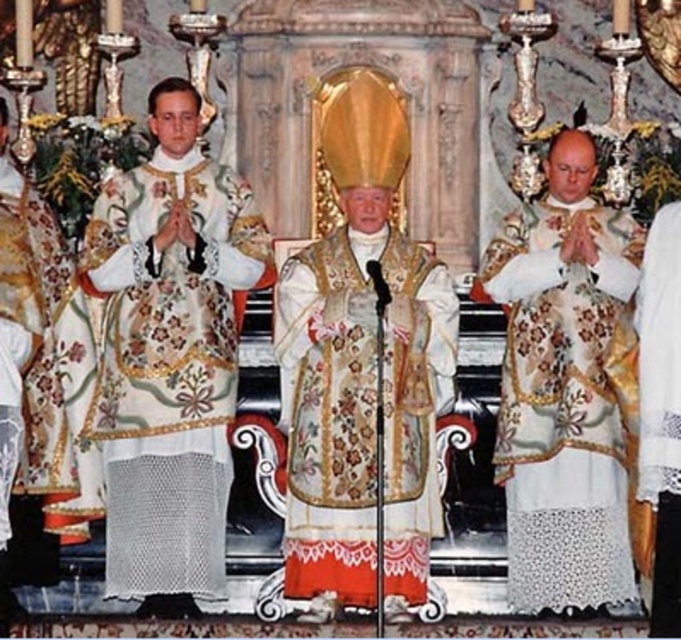
Question: Is embroidered silk vestment at center thinner than white lace robe at right?

Choices:
 (A) yes
 (B) no

Answer: (B)

Question: Which point appears closest to the camera in this image?

Choices:
 (A) (355, 536)
 (B) (3, 344)
 (C) (550, 221)

Answer: (B)

Question: Which point is farther to the camera?

Choices:
 (A) white embroidered robe at center
 (B) white lace robe at right
 (C) embroidered silk vestment at center

Answer: (A)

Question: Which point appears farthest from the camera in this image?

Choices:
 (A) (571, 209)
 (B) (646, 324)
 (C) (364, 582)
 (D) (202, 188)

Answer: (A)

Question: From the image, what is the correct spatial relationship of white embroidered robe at center in relation to white lace robe at center?

Choices:
 (A) below
 (B) above

Answer: (B)

Question: Does embroidered silk vestment at center appear on the right side of white embroidered robe at left?

Choices:
 (A) yes
 (B) no

Answer: (A)